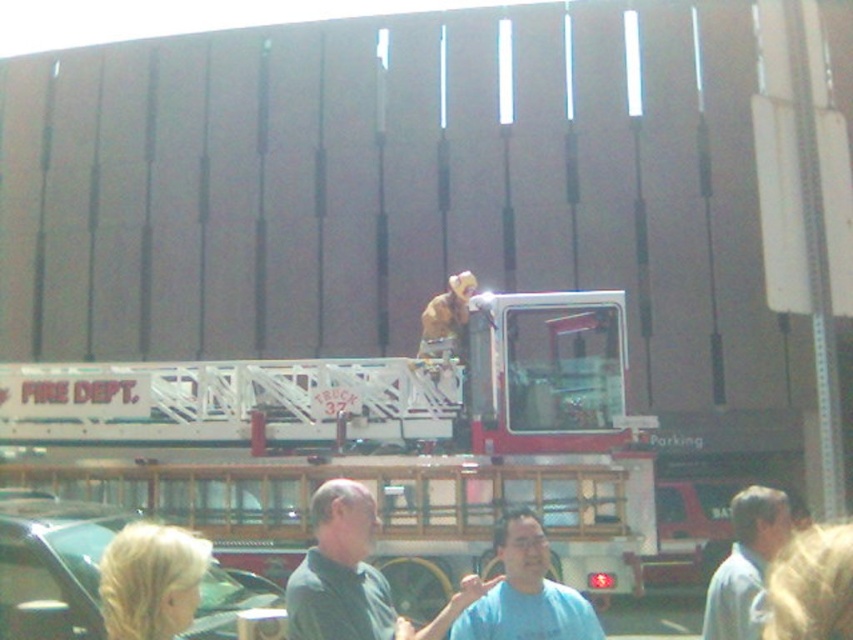
Which is more to the right, white metallic ladder at center or blue t-shirt at center?

Positioned to the right is blue t-shirt at center.

Does white metallic ladder at center have a lesser width compared to blue t-shirt at center?

No, white metallic ladder at center is not thinner than blue t-shirt at center.

In order to click on white metallic ladder at center in this screenshot , I will do `click(368, 444)`.

Locate an element on the screen. white metallic ladder at center is located at coordinates (368, 444).

Who is lower down, white metallic ladder at center or gray-green shirt at center?

gray-green shirt at center is below.

In the scene shown: Does white metallic ladder at center have a lesser height compared to gray-green shirt at center?

Indeed, white metallic ladder at center has a lesser height compared to gray-green shirt at center.

Image resolution: width=853 pixels, height=640 pixels. What do you see at coordinates (368, 444) in the screenshot? I see `white metallic ladder at center` at bounding box center [368, 444].

At what (x,y) coordinates should I click in order to perform the action: click on white metallic ladder at center. Please return your answer as a coordinate pair (x, y). The image size is (853, 640). Looking at the image, I should click on click(x=368, y=444).

Is blonde hair at lower left taller than brown leather jacket at upper center?

In fact, blonde hair at lower left may be shorter than brown leather jacket at upper center.

Who is taller, blonde hair at lower left or brown leather jacket at upper center?

Standing taller between the two is brown leather jacket at upper center.

The width and height of the screenshot is (853, 640). I want to click on blonde hair at lower left, so click(151, 580).

I want to click on blonde hair at lower left, so click(x=151, y=580).